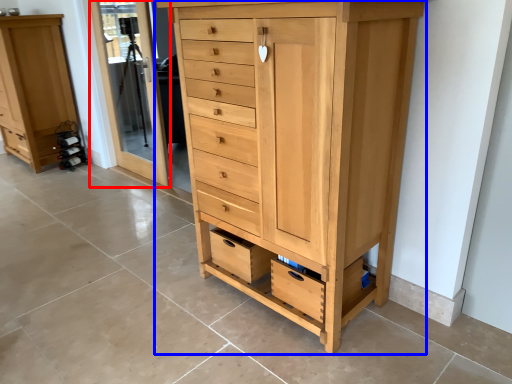
Question: Which point is further to the camera, screen door (highlighted by a red box) or chest of drawers (highlighted by a blue box)?

Choices:
 (A) screen door
 (B) chest of drawers

Answer: (A)